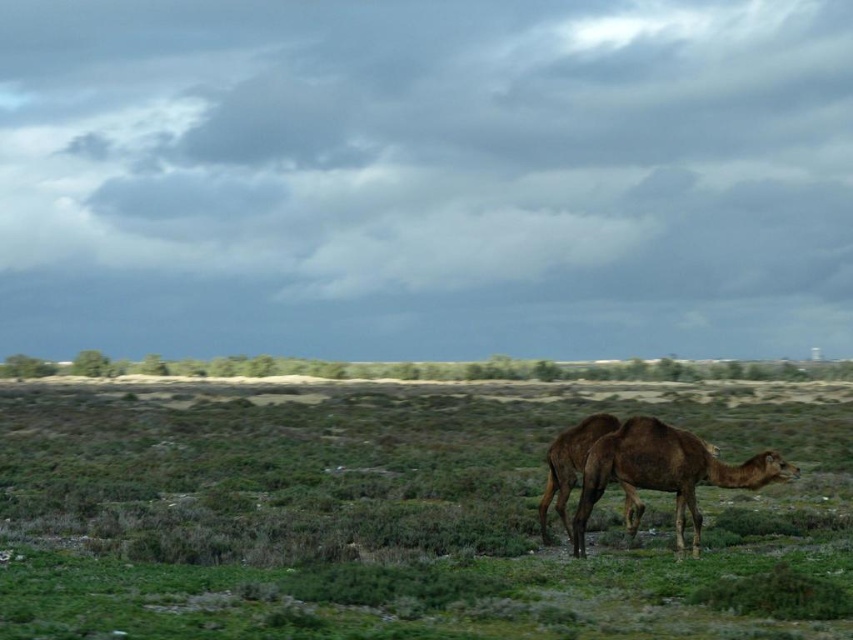
Question: Does green grassy at center come in front of brown matte camel at lower right?

Choices:
 (A) yes
 (B) no

Answer: (A)

Question: Which object is closer to the camera taking this photo?

Choices:
 (A) green grassy at center
 (B) brown matte camel at lower right

Answer: (A)

Question: Can you confirm if green grassy at center is thinner than brown matte camel at lower right?

Choices:
 (A) yes
 (B) no

Answer: (B)

Question: Can you confirm if green grassy at center is smaller than brown matte camel at lower right?

Choices:
 (A) yes
 (B) no

Answer: (B)

Question: Which object is closer to the camera taking this photo?

Choices:
 (A) green grassy at center
 (B) brown matte camel at lower right

Answer: (A)